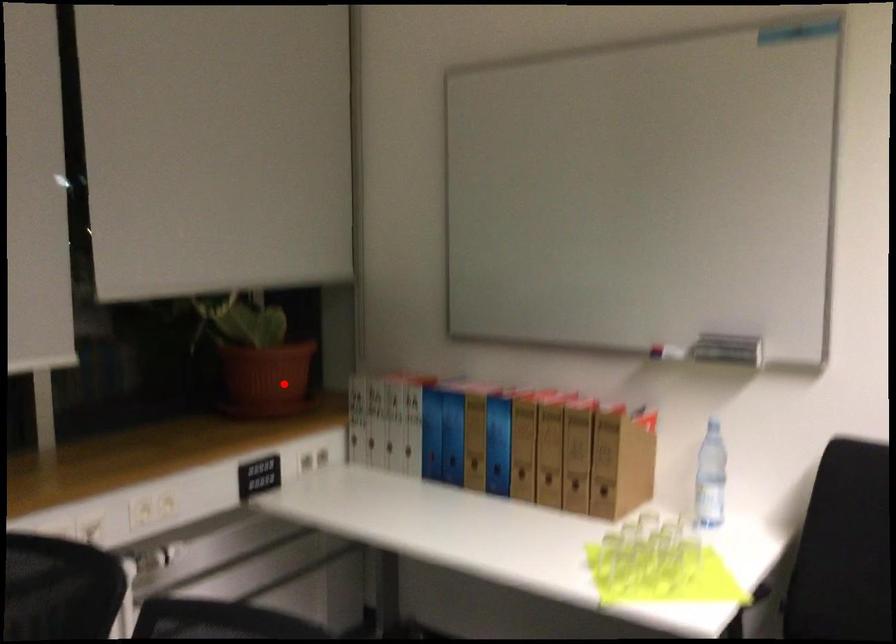
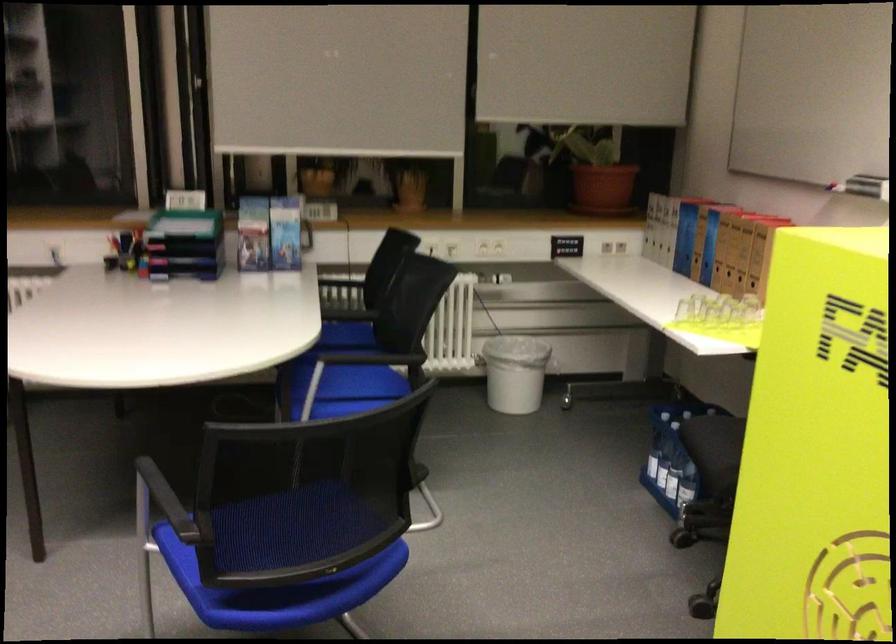
Question: I am providing you with two images of the same scene from different viewpoints. Given a red point in image1, look at the same physical point in image2. Is it:

Choices:
 (A) Closer to the viewpoint
 (B) Farther from the viewpoint

Answer: (B)